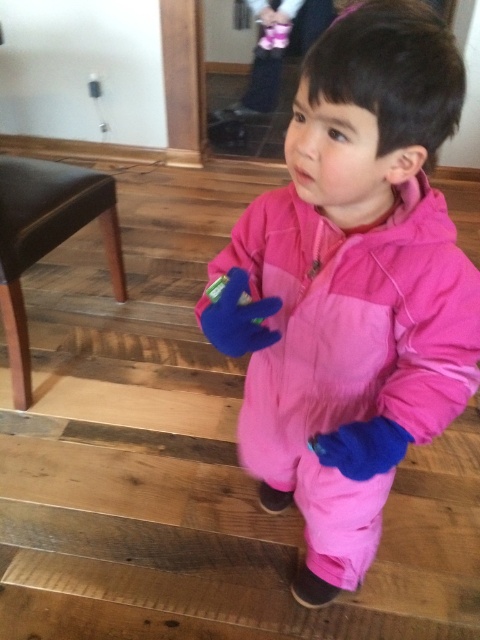
Is point (294, 243) farther from viewer compared to point (118, 252)?

No, (294, 243) is closer to viewer.

Identify the location of pink fleece snowsuit at center. (351, 288).